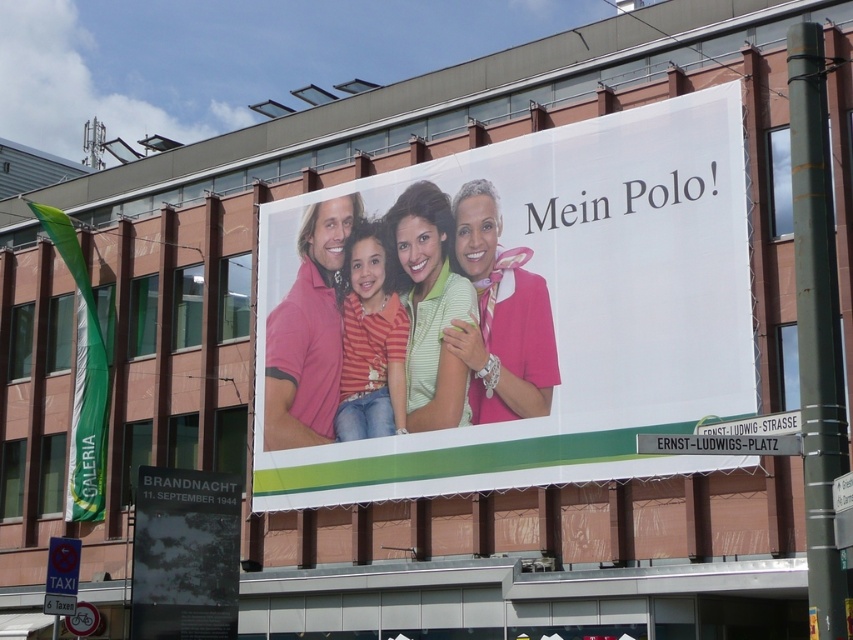
Who is more forward, (547, 300) or (155, 561)?

Point (155, 561)

What do you see at coordinates (517, 310) in the screenshot?
I see `matte pink polo shirt at center` at bounding box center [517, 310].

The height and width of the screenshot is (640, 853). In order to click on matte pink polo shirt at center in this screenshot , I will do `click(517, 310)`.

Identify the location of black textured poster at lower left. (184, 554).

Describe the element at coordinates (184, 554) in the screenshot. Image resolution: width=853 pixels, height=640 pixels. I see `black textured poster at lower left` at that location.

Find the location of a particular element. black textured poster at lower left is located at coordinates (184, 554).

Can you confirm if black textured poster at lower left is positioned to the left of pink cotton polo shirt at center?

Yes, black textured poster at lower left is to the left of pink cotton polo shirt at center.

Can you confirm if black textured poster at lower left is taller than pink cotton polo shirt at center?

Correct, black textured poster at lower left is much taller as pink cotton polo shirt at center.

Between point (183, 632) and point (291, 384), which one is positioned in front?

Point (183, 632) is more forward.

Identify the location of black textured poster at lower left. (184, 554).